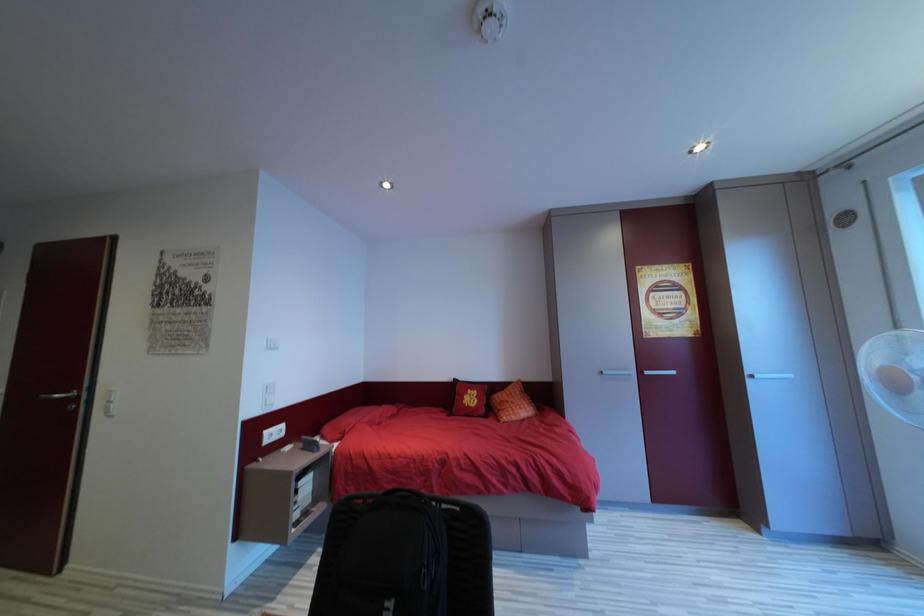
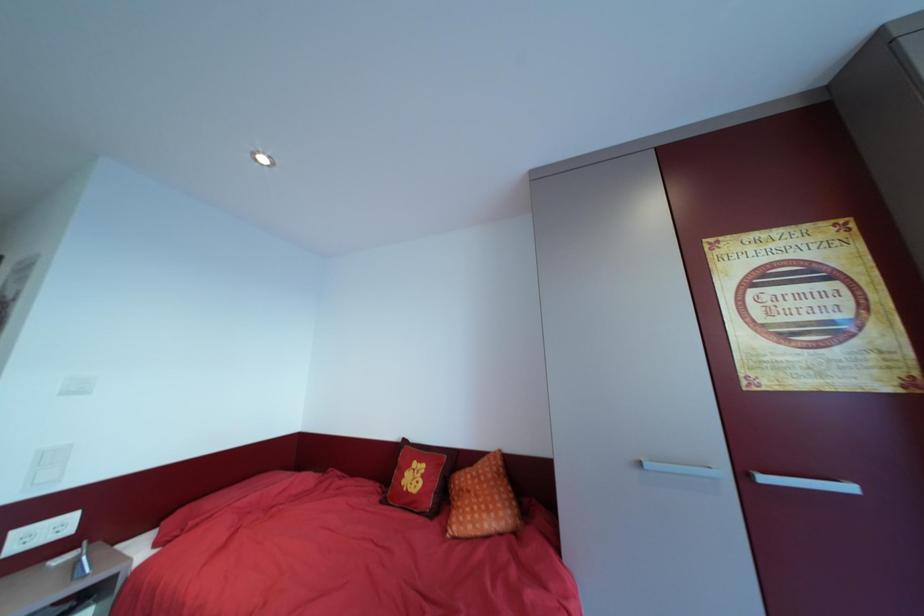
What movement of the cameraman would produce the second image?

The cameraman walked toward right, forward.